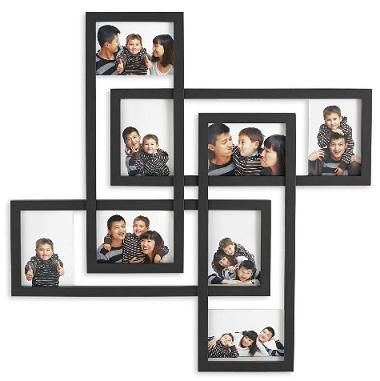
Where is `photographs`? The image size is (380, 381). photographs is located at coordinates (41, 258), (140, 230), (143, 145), (134, 59), (247, 154), (237, 264), (245, 336), (326, 147).